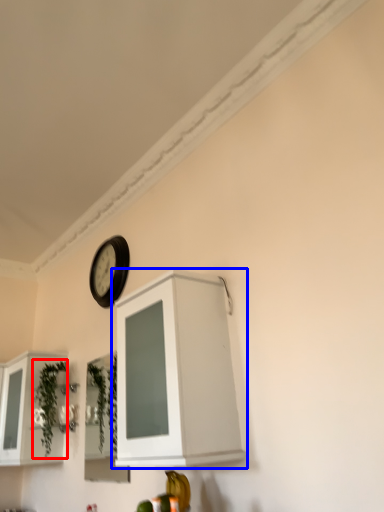
Question: Which object is further to the camera taking this photo, plant (highlighted by a red box) or cabinetry (highlighted by a blue box)?

Choices:
 (A) plant
 (B) cabinetry

Answer: (A)